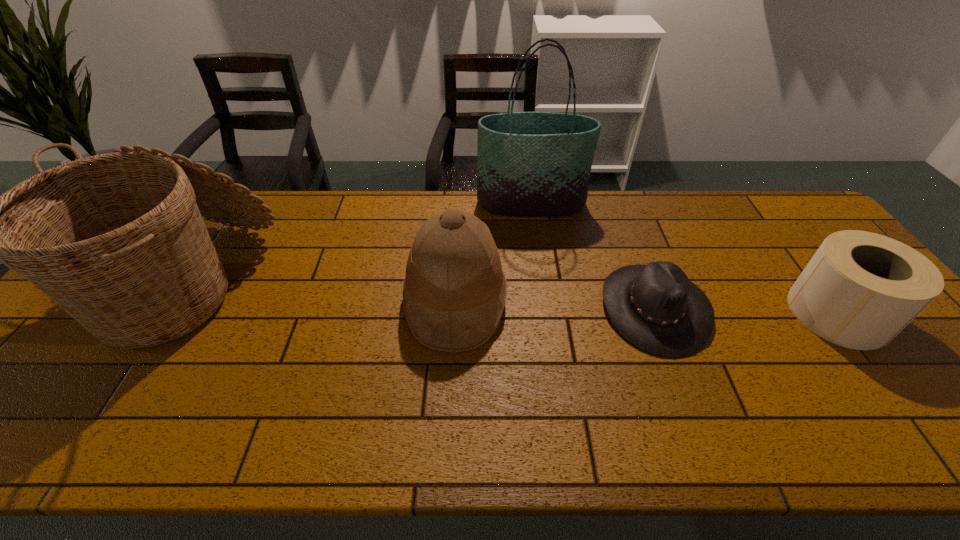
What are the coordinates of `object at the right edge` in the screenshot? It's located at (860, 289).

This screenshot has height=540, width=960. I want to click on object positioned at the far left corner, so click(x=117, y=240).

This screenshot has height=540, width=960. In the image, there is a desktop. Identify the location of vacant space at the far edge. (273, 233).

Locate an element on the screen. The width and height of the screenshot is (960, 540). vacant space at the near edge of the desktop is located at coordinates (771, 416).

You are a GUI agent. You are given a task and a screenshot of the screen. Output one action in this format:
    pyautogui.click(x=<x>, y=<y>)
    Task: Click on the vacant space at the right edge of the desktop
    The image size is (960, 540).
    Given the screenshot: What is the action you would take?
    pyautogui.click(x=925, y=413)

In order to click on vacant space at the far right corner in this screenshot , I will do `click(777, 210)`.

The image size is (960, 540). In order to click on free spot between the fourth tallest object and the fourth shortest object in this screenshot , I will do `click(512, 300)`.

Identify the location of unoccupied area between the rightmost object and the leftmost object. This screenshot has width=960, height=540. (512, 300).

Locate an element on the screen. free area in between the third shortest object and the second tallest object is located at coordinates (321, 294).

Where is `empty space that is in between the right hat and the second shortest object`? This screenshot has width=960, height=540. empty space that is in between the right hat and the second shortest object is located at coordinates (746, 310).